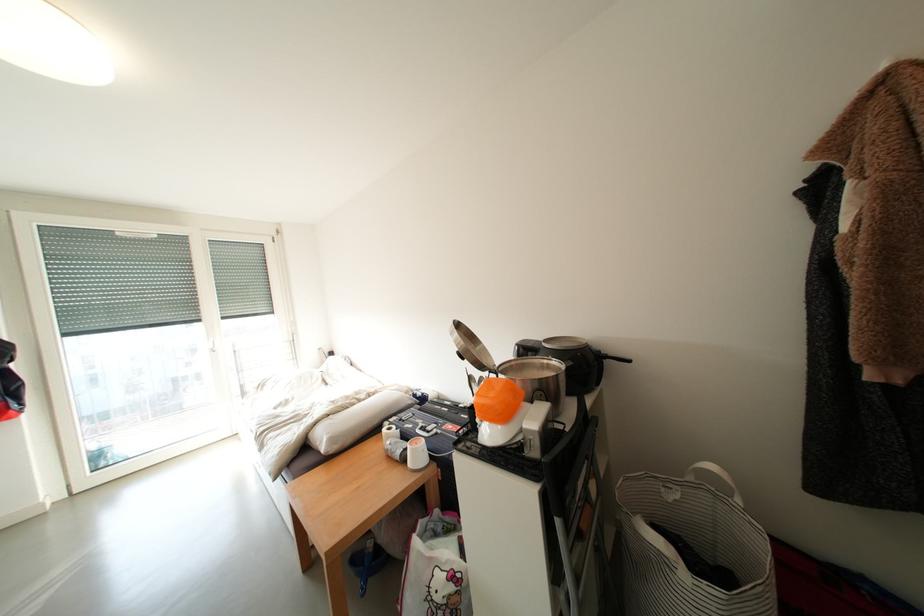
Which object does [516,369] point to?

This point indicates the silver cooking pot.